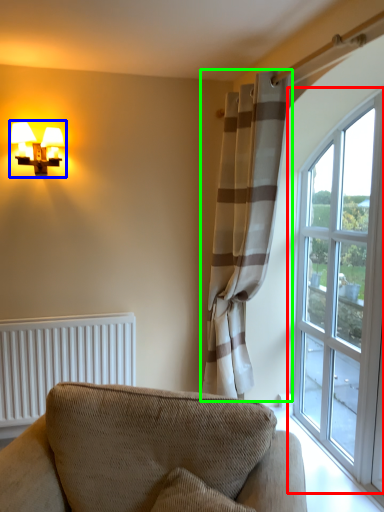
Question: Based on their relative distances, which object is nearer to window (highlighted by a red box)? Choose from table lamp (highlighted by a blue box) and curtain (highlighted by a green box).

Choices:
 (A) table lamp
 (B) curtain

Answer: (B)